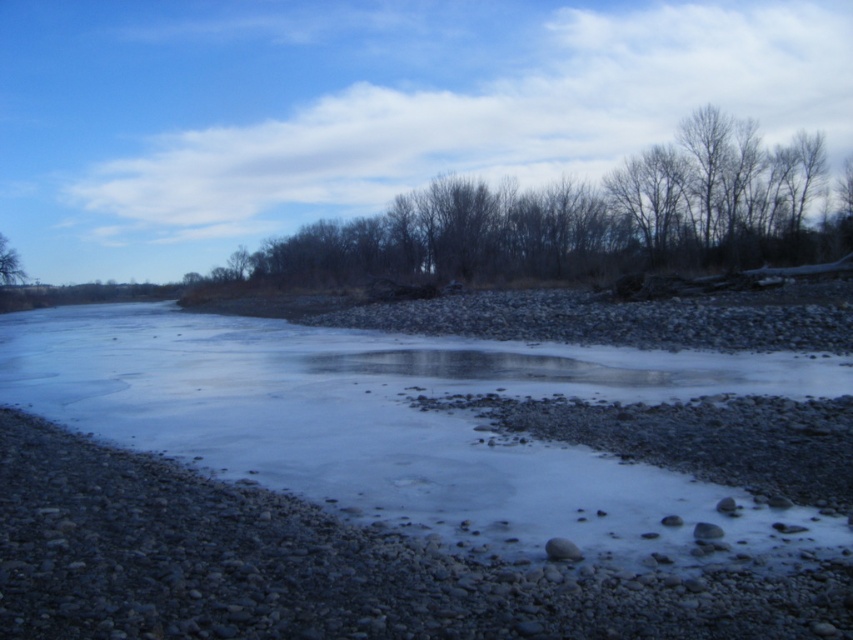
You are an ornithologist observing birds in the winter landscape. You notice two trees in the scene. The first has bare branches at upper center, and the second is a brown rough tree at left. Which tree is positioned higher in the image?

The bare branches at upper center is positioned higher in the image than the brown rough tree at left.

You are a geologist examining the riverbed. You notice two smooth gray rocks in the scene. Which one is taller, the smooth gray rock at center or the smooth gray rock at lower right?

The smooth gray rock at center is much taller than the smooth gray rock at lower right according to the description.